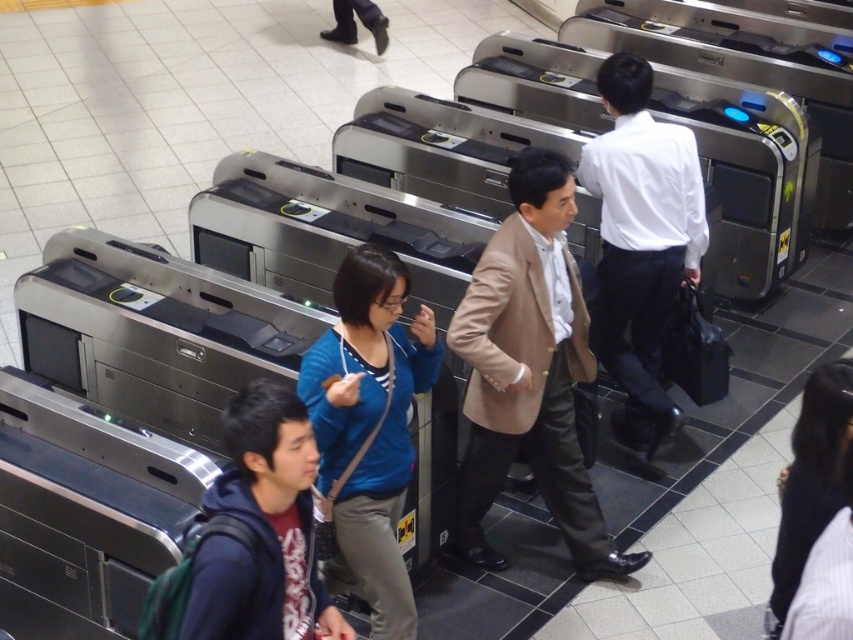
You are a person carrying a large backpack and need to pass through the turnstiles at the train station. You notice a blue fabric jacket at center and a white glossy shirt at upper right in your path. Which item has a narrower width that might allow easier passage through the turnstiles?

The blue fabric jacket at center has a width less than the white glossy shirt at upper right, so it is narrower and might allow easier passage through the turnstiles.

You are standing at the entrance of the train station and see two points marked on the floor. The first point is at coordinate point (x=779, y=493) and the second is at point (x=347, y=35). Which point is closer to you as you stand at the entrance?

Point (x=779, y=493) is closer to the camera than point (x=347, y=35), so the first point is closer to you as you stand at the entrance.